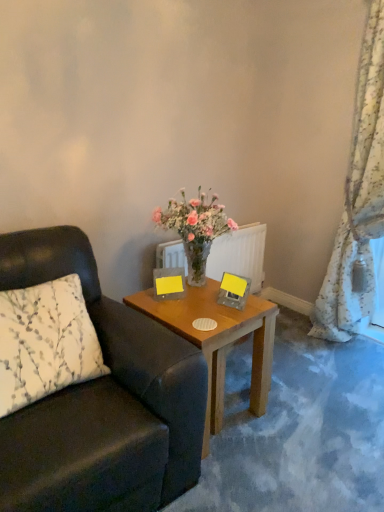
Question: Considering the positions of yellow paper at center, the 1th picture frame when ordered from right to left, and white printed fabric pillow at left in the image, is yellow paper at center, the 1th picture frame when ordered from right to left, taller or shorter than white printed fabric pillow at left?

Choices:
 (A) short
 (B) tall

Answer: (A)

Question: Does point (233, 278) appear closer or farther from the camera than point (51, 337)?

Choices:
 (A) closer
 (B) farther

Answer: (B)

Question: Estimate the real-world distances between objects in this image. Which object is closer to the wooden table at center?

Choices:
 (A) floral fabric curtain at right
 (B) matte yellow picture frame at upper center, the first picture frame from the left
 (C) clear glass radiator at center
 (D) yellow paper at center, the 1th picture frame when ordered from right to left
 (E) leather cushion at left

Answer: (D)

Question: Based on their relative distances, which object is nearer to the floral fabric curtain at right?

Choices:
 (A) clear glass radiator at center
 (B) yellow paper at center, placed as the second picture frame when sorted from left to right
 (C) white printed fabric pillow at left
 (D) leather cushion at left
 (E) matte yellow picture frame at upper center, the 2th picture frame viewed from the right

Answer: (A)